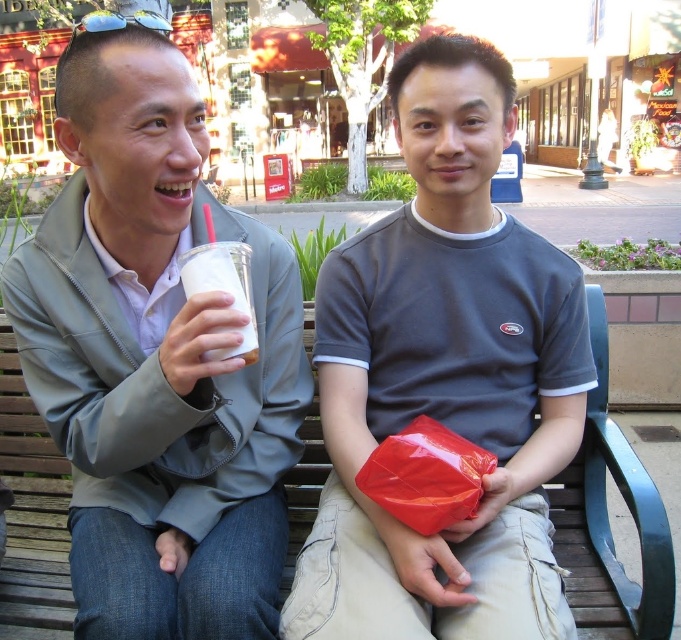
You are designing a display stand that needs to accommodate both the matte plastic cup at left and the matte gray shirt at center. Given their sizes, which object requires a wider space on the stand?

The matte gray shirt at center requires a wider space on the stand since its width is greater than the matte plastic cup at left.